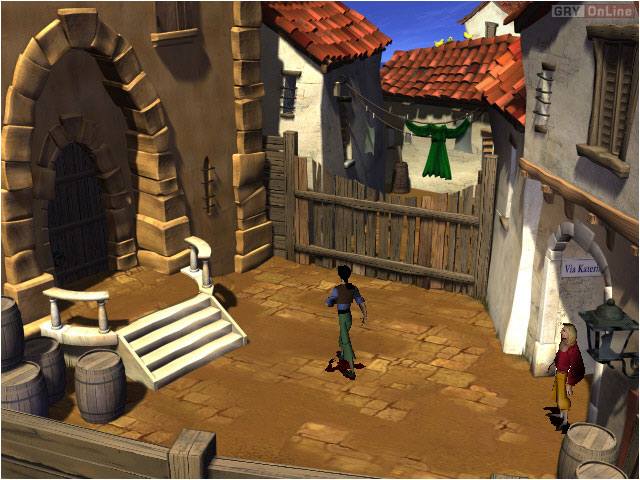
Where is `shutters`? This screenshot has height=480, width=640. shutters is located at coordinates (621, 115).